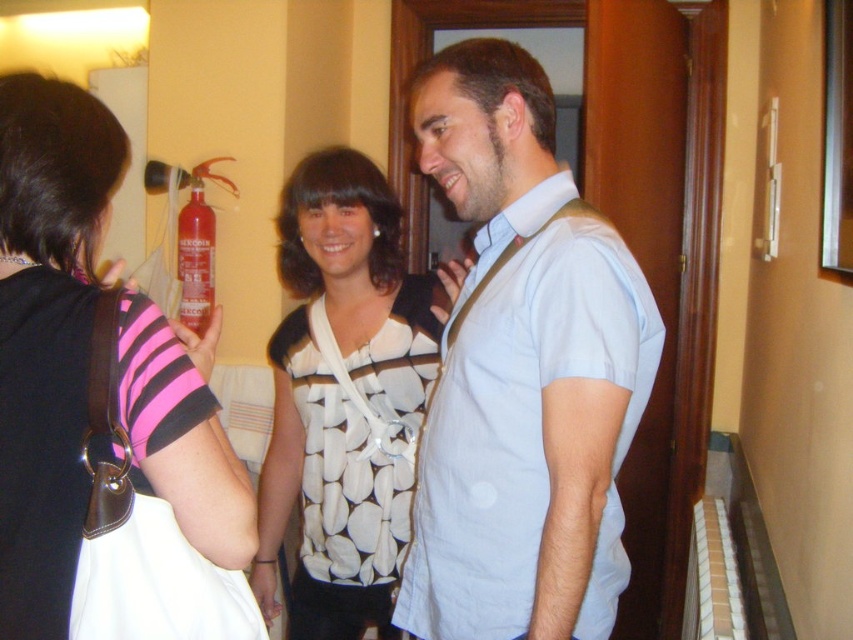
You are a delivery person who needs to place a small package between the pink striped shirt at upper left and the white dotted fabric at center. The package is 12 inches long. Is there enough space between them to fit the package?

The pink striped shirt at upper left is 26.05 inches away from the white dotted fabric at center, so yes, the package can fit between them since the distance is greater than the package length.